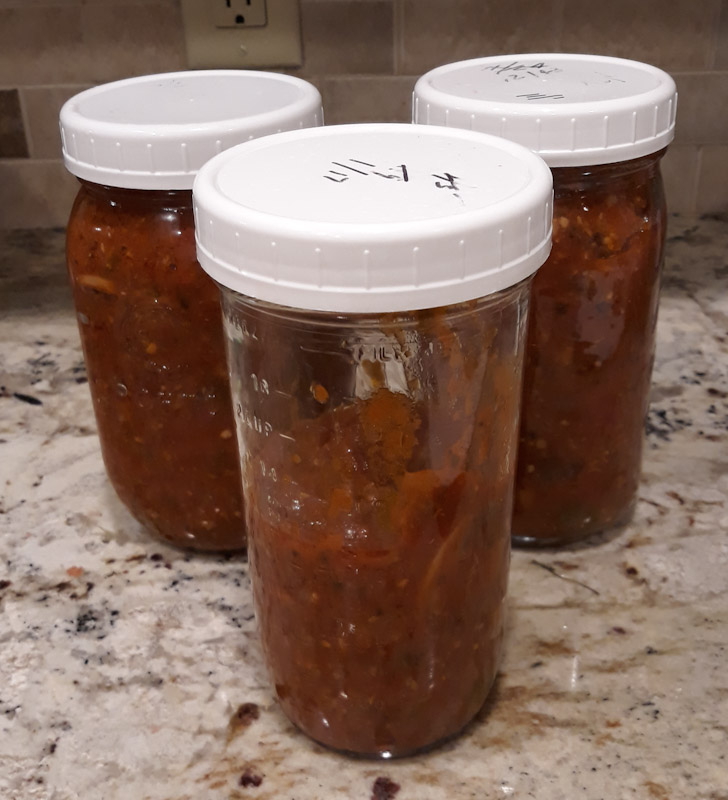
At what (x,y) coordinates should I click in order to perform the action: click on back splash. Please return your answer as a coordinate pair (x, y). Looking at the image, I should click on (92, 26).